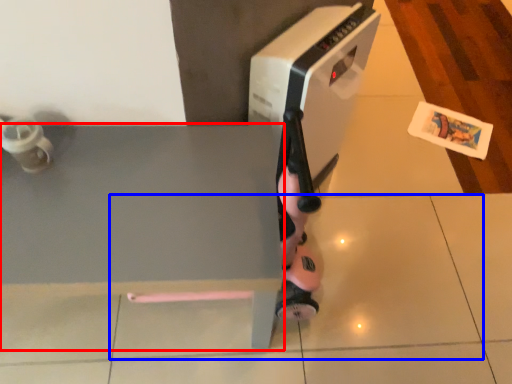
Question: Among these objects, which one is farthest to the camera, table (highlighted by a red box) or tile (highlighted by a blue box)?

Choices:
 (A) table
 (B) tile

Answer: (B)